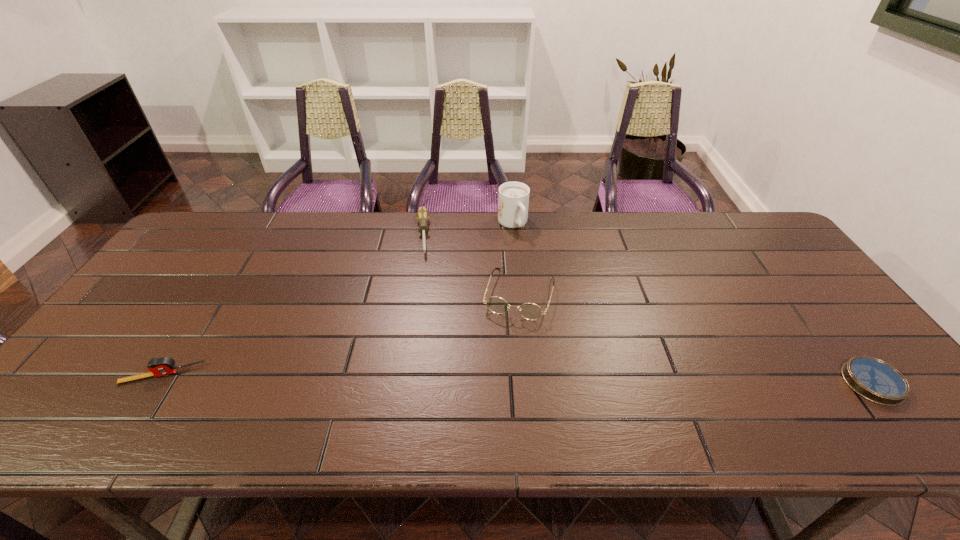
Locate an element on the screen. free spot on the desktop that is between the tape measure and the shortest object and is positioned on the lenses of the second tallest object is located at coordinates (494, 378).

You are a GUI agent. You are given a task and a screenshot of the screen. Output one action in this format:
    pyautogui.click(x=<x>, y=<y>)
    Task: Click on the free spot on the desktop that is between the leftmost object and the rightmost object and is positioned at the tip of the fourth object from right to left
    Image resolution: width=960 pixels, height=540 pixels.
    Given the screenshot: What is the action you would take?
    pyautogui.click(x=429, y=377)

At what (x,y) coordinates should I click in order to perform the action: click on free space on the desktop that is between the tape measure and the shortest object and is positioned on the side with the handle of the tallest object. Please return your answer as a coordinate pair (x, y). The width and height of the screenshot is (960, 540). Looking at the image, I should click on (613, 380).